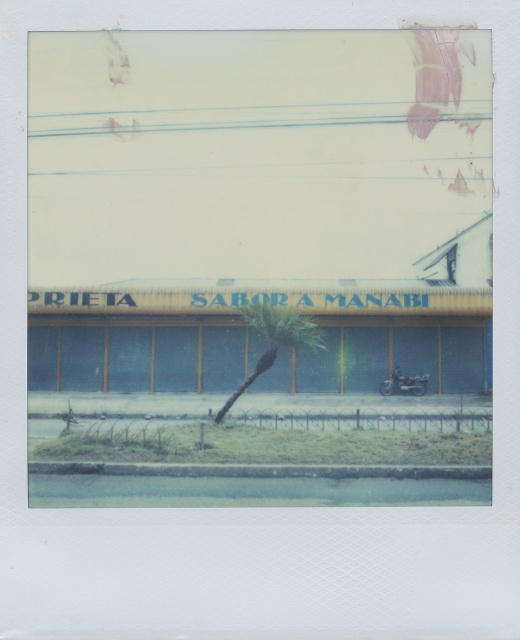
Question: Is green leafy tree at center below shiny black motorcycle at center?

Choices:
 (A) yes
 (B) no

Answer: (B)

Question: Can you confirm if green leafy tree at center is thinner than shiny black motorcycle at center?

Choices:
 (A) no
 (B) yes

Answer: (A)

Question: Which point is closer to the camera taking this photo?

Choices:
 (A) (424, 374)
 (B) (269, 356)

Answer: (B)

Question: Is green leafy tree at center further to the viewer compared to shiny black motorcycle at center?

Choices:
 (A) no
 (B) yes

Answer: (A)

Question: Among these objects, which one is farthest from the camera?

Choices:
 (A) shiny black motorcycle at center
 (B) green leafy tree at center

Answer: (A)